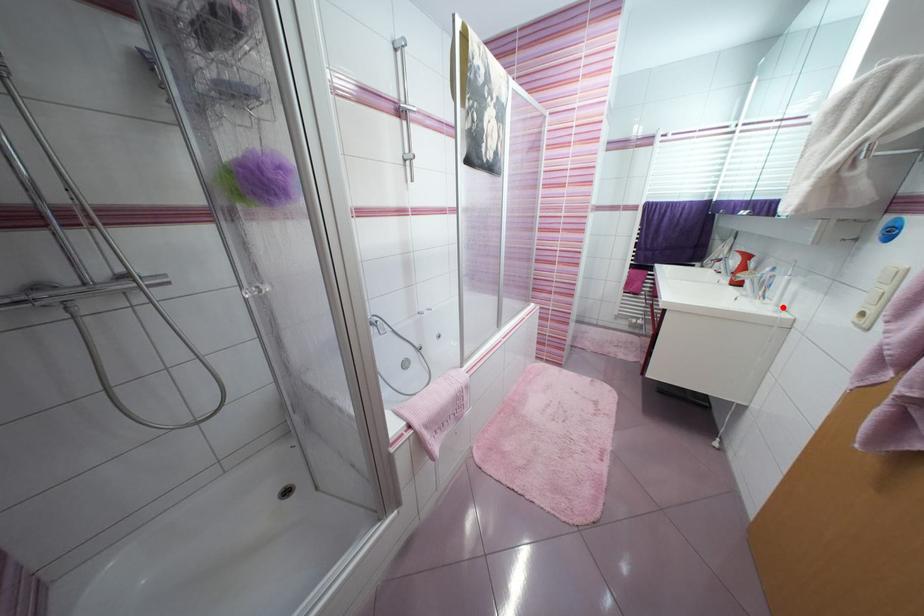
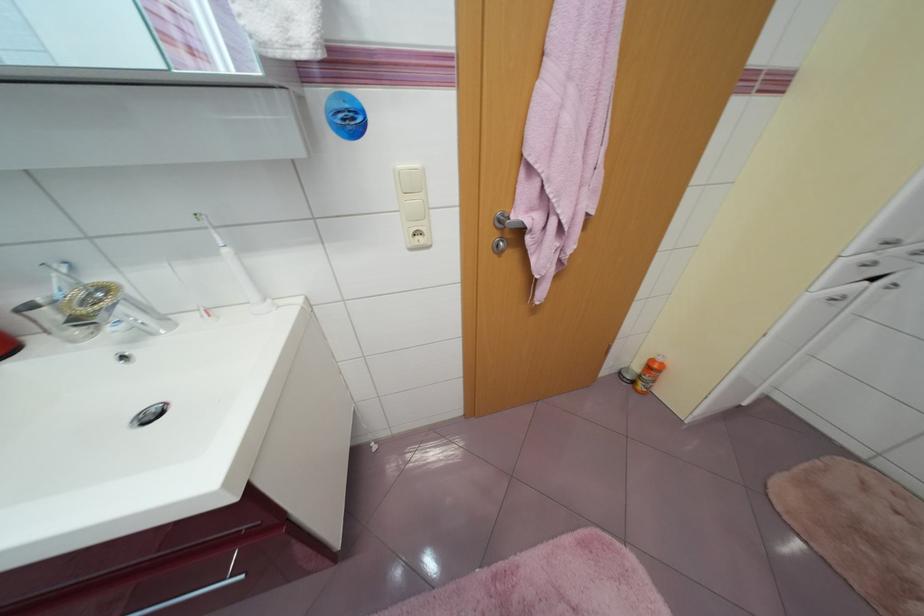
In the second image, find the point that corresponds to the highlighted location in the first image.

(270, 302)